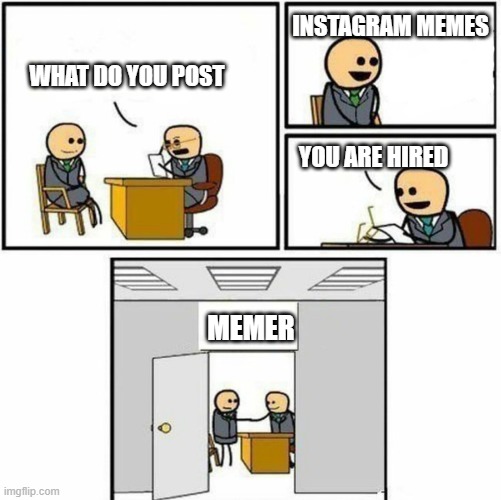
Find the location of a particular element. This screenshot has height=500, width=501. door is located at coordinates (193, 435).